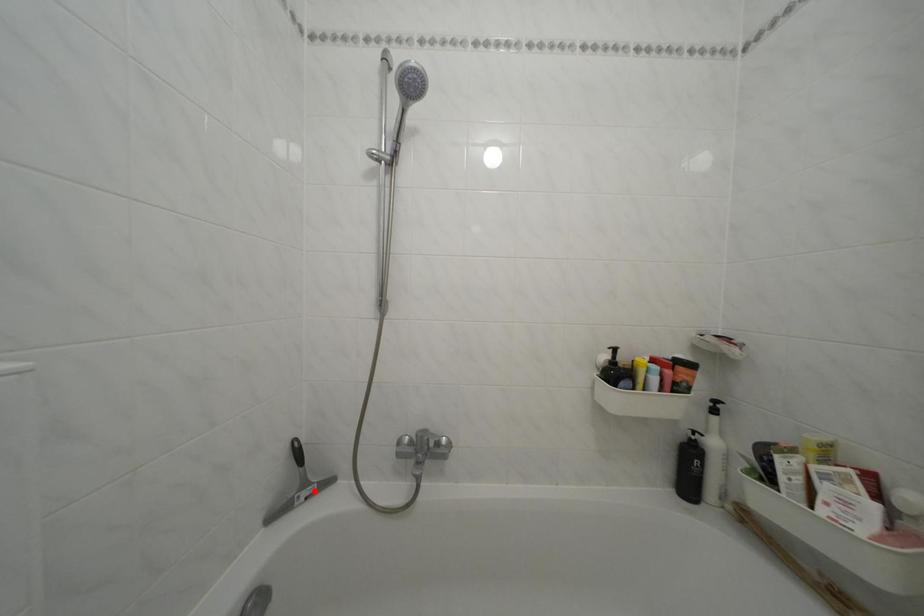
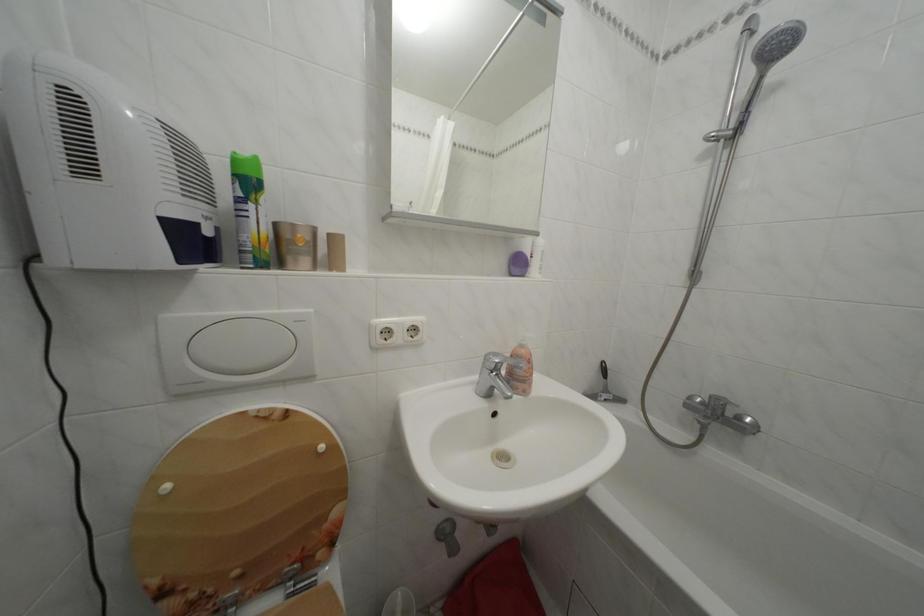
The point at the highlighted location is marked in the first image. Where is the corresponding point in the second image?

(614, 397)